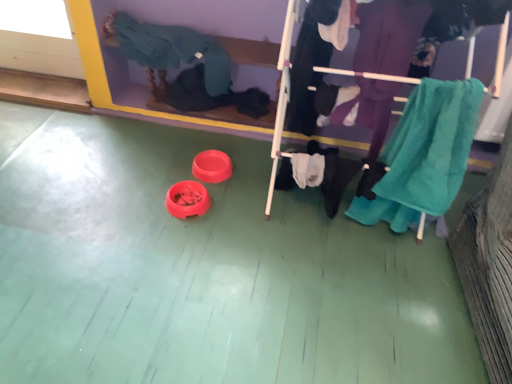
Question: Is teal fabric clothes rack at center closer to the viewer compared to teal towel at right, the first clothing positioned from the right?

Choices:
 (A) yes
 (B) no

Answer: (A)

Question: From a real-world perspective, does teal fabric clothes rack at center stand above teal towel at right, the third clothing viewed from the left?

Choices:
 (A) no
 (B) yes

Answer: (B)

Question: Can you confirm if teal fabric clothes rack at center is positioned to the left of teal towel at right, the third clothing viewed from the left?

Choices:
 (A) yes
 (B) no

Answer: (A)

Question: From the image's perspective, does teal fabric clothes rack at center appear lower than teal towel at right, the third clothing viewed from the left?

Choices:
 (A) no
 (B) yes

Answer: (A)

Question: Is teal fabric clothes rack at center surrounding teal towel at right, the first clothing positioned from the right?

Choices:
 (A) no
 (B) yes

Answer: (B)

Question: From the image's perspective, is black cotton pants at center, which is counted as the 2th clothing, starting from the left, located above or below teal fabric clothes rack at center?

Choices:
 (A) above
 (B) below

Answer: (B)

Question: Does point (279, 173) appear closer or farther from the camera than point (295, 3)?

Choices:
 (A) closer
 (B) farther

Answer: (B)

Question: From their relative heights in the image, would you say black cotton pants at center, which is counted as the 2th clothing, starting from the left, is taller or shorter than teal fabric clothes rack at center?

Choices:
 (A) short
 (B) tall

Answer: (A)

Question: From a real-world perspective, is black cotton pants at center, which is counted as the 2th clothing, starting from the left, physically located above or below teal fabric clothes rack at center?

Choices:
 (A) above
 (B) below

Answer: (B)

Question: In terms of size, does knitted teal sweater at upper left, which ranks as the 1th clothing in left-to-right order, appear bigger or smaller than black cotton pants at center, which is counted as the 2th clothing, starting from the left?

Choices:
 (A) small
 (B) big

Answer: (B)

Question: In terms of width, does knitted teal sweater at upper left, the third clothing from the right, look wider or thinner when compared to black cotton pants at center, which is counted as the 2th clothing, starting from the left?

Choices:
 (A) thin
 (B) wide

Answer: (A)

Question: From the image's perspective, is knitted teal sweater at upper left, which ranks as the 1th clothing in left-to-right order, positioned above or below black cotton pants at center, which is counted as the 2th clothing, starting from the left?

Choices:
 (A) below
 (B) above

Answer: (B)

Question: Would you say knitted teal sweater at upper left, which ranks as the 1th clothing in left-to-right order, is to the left or to the right of black cotton pants at center, which is counted as the 2th clothing, starting from the left, in the picture?

Choices:
 (A) left
 (B) right

Answer: (A)

Question: Which is correct: teal fabric clothes rack at center is inside teal towel at right, the third clothing viewed from the left, or outside of it?

Choices:
 (A) inside
 (B) outside

Answer: (B)

Question: Is point (474, 41) positioned closer to the camera than point (456, 152)?

Choices:
 (A) farther
 (B) closer

Answer: (A)